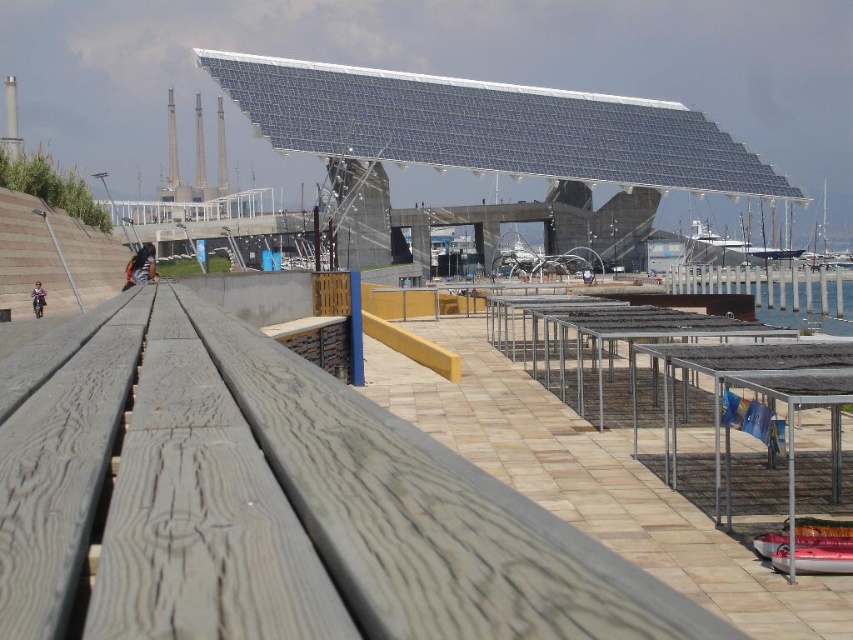
You are standing at the point marked as point (270,502) in the image. What object are you standing on?

You are standing on the weathered wood dock at center located at point (270,502).

You are a maintenance worker who needs to reach the clear water at lower right from the weathered wood dock at center. Given that your equipment can only travel 90 meters, will you be able to reach it without needing to recharge?

The weathered wood dock at center is 90.96 meters from clear water at lower right. Since the equipment can only travel 90 meters, you will not be able to reach it without needing to recharge.

You are standing on the paved area and want to walk to the marina. Which direction should you head towards from the weathered wood dock at center to reach the clear water at lower right?

To reach the clear water at lower right from the weathered wood dock at center, you should head to the right since the clear water at lower right is located to the right of the weathered wood dock at center.